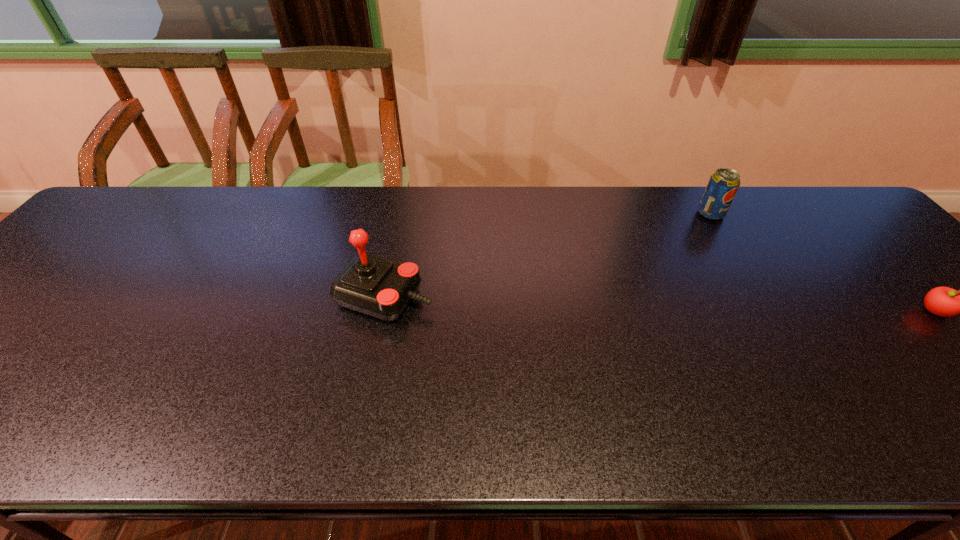
Image resolution: width=960 pixels, height=540 pixels. Identify the location of the tallest object. (382, 288).

Identify the location of the leftmost object. (382, 288).

Where is `the second object from left to right`? the second object from left to right is located at coordinates (722, 187).

Locate an element on the screen. The width and height of the screenshot is (960, 540). the second tallest object is located at coordinates (722, 187).

Where is `vacant space situated 0.160m on the right of the leftmost object`? This screenshot has width=960, height=540. vacant space situated 0.160m on the right of the leftmost object is located at coordinates (500, 296).

Identify the location of vacant space situated 0.280m on the front of the second object from right to left. This screenshot has width=960, height=540. click(758, 293).

Find the location of a particular element. The width and height of the screenshot is (960, 540). object at the far edge is located at coordinates (722, 187).

This screenshot has width=960, height=540. Identify the location of vacant space at the far edge of the desktop. (660, 203).

The image size is (960, 540). Find the location of `vacant space at the near edge of the desktop`. vacant space at the near edge of the desktop is located at coordinates (87, 445).

This screenshot has width=960, height=540. In order to click on vacant space that's between the joystick and the second shortest object in this screenshot , I will do `click(548, 255)`.